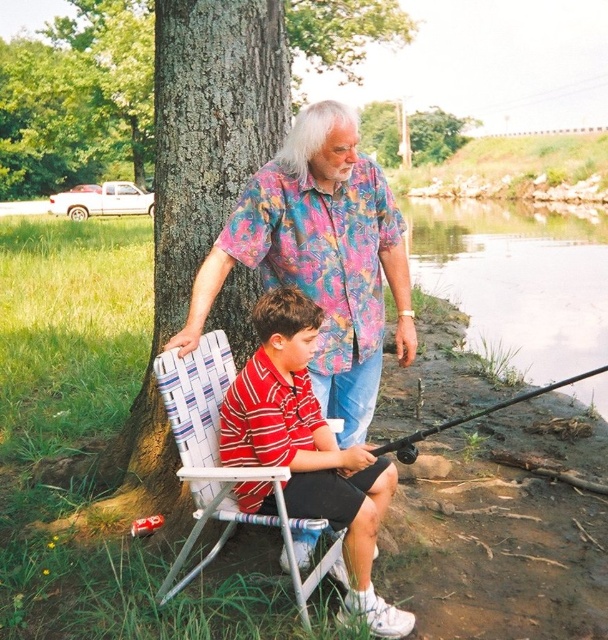
Question: Is the position of white woven folding chair at center less distant than that of green textured tree at center?

Choices:
 (A) yes
 (B) no

Answer: (A)

Question: Which object is closer to the camera taking this photo?

Choices:
 (A) black matte fishing pole at lower right
 (B) green textured tree trunk at center

Answer: (A)

Question: Which point appears closest to the camera in this image?

Choices:
 (A) (385, 204)
 (B) (201, 524)

Answer: (B)

Question: Which object is positioned farthest from the white woven folding chair at center?

Choices:
 (A) striped cotton shirt at center
 (B) floral shirt at upper center
 (C) clear water at lower right
 (D) green rough bark tree at center

Answer: (D)

Question: In this image, where is green rough bark tree at center located relative to white woven folding chair at center?

Choices:
 (A) right
 (B) left

Answer: (B)

Question: Does green textured tree trunk at center come behind white woven folding chair at center?

Choices:
 (A) yes
 (B) no

Answer: (A)